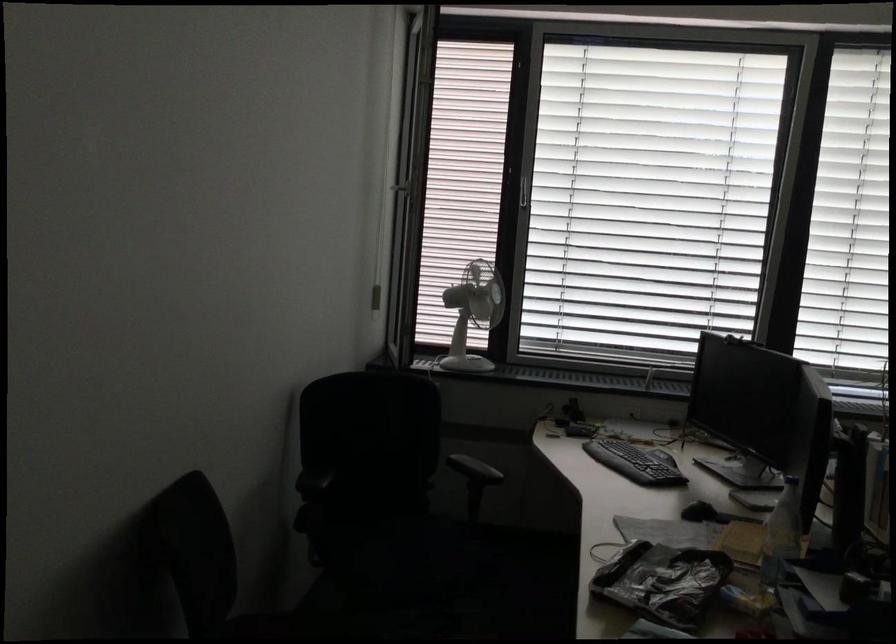
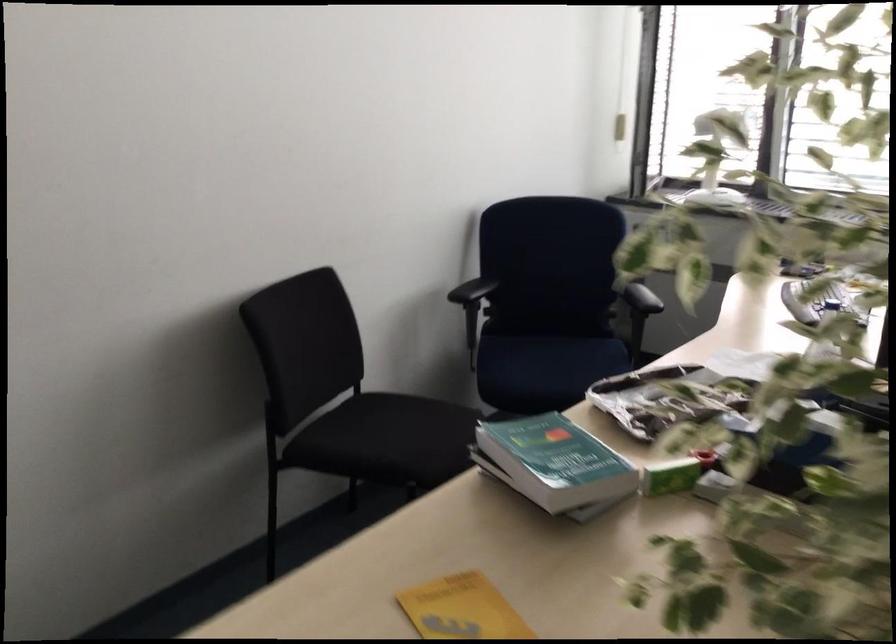
Where in the second image is the point corresponding to (x=410, y=559) from the first image?

(547, 366)